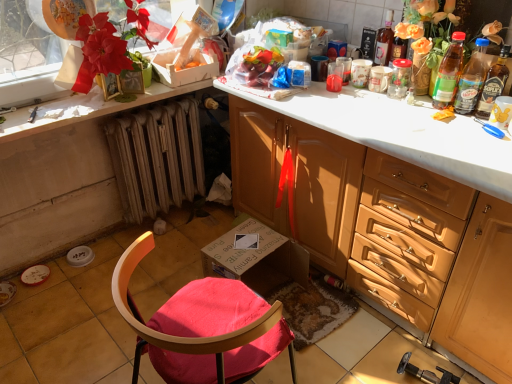
Question: Can you confirm if translucent plastic bottle at upper right, marked as the 3th bottle in a right-to-left arrangement, is smaller than wooden radiator at lower left?

Choices:
 (A) yes
 (B) no

Answer: (A)

Question: From a real-world perspective, is translucent plastic bottle at upper right, marked as the 3th bottle in a right-to-left arrangement, on wooden radiator at lower left?

Choices:
 (A) no
 (B) yes

Answer: (B)

Question: From the image's perspective, does translucent plastic bottle at upper right, marked as the 3th bottle in a right-to-left arrangement, appear higher than wooden radiator at lower left?

Choices:
 (A) no
 (B) yes

Answer: (B)

Question: Is translucent plastic bottle at upper right, marked as the 3th bottle in a right-to-left arrangement, positioned far away from wooden radiator at lower left?

Choices:
 (A) yes
 (B) no

Answer: (A)

Question: From the image's perspective, would you say translucent plastic bottle at upper right, which appears as the second bottle when viewed from the left, is shown under wooden radiator at lower left?

Choices:
 (A) no
 (B) yes

Answer: (A)

Question: Which is correct: wooden radiator at lower left is inside translucent plastic bottle at upper right, the 1th bottle when ordered from right to left, or outside of it?

Choices:
 (A) outside
 (B) inside

Answer: (A)

Question: In the image, is wooden radiator at lower left on the left side or the right side of translucent plastic bottle at upper right, acting as the 4th bottle starting from the left?

Choices:
 (A) left
 (B) right

Answer: (A)

Question: Is wooden radiator at lower left bigger or smaller than translucent plastic bottle at upper right, acting as the 4th bottle starting from the left?

Choices:
 (A) small
 (B) big

Answer: (B)

Question: Considering their positions, is wooden radiator at lower left located in front of or behind translucent plastic bottle at upper right, the 1th bottle when ordered from right to left?

Choices:
 (A) behind
 (B) front

Answer: (A)

Question: Is white glossy countertop at upper left inside or outside of translucent plastic bottle at upper right, which is counted as the 2th bottle, starting from the right?

Choices:
 (A) inside
 (B) outside

Answer: (B)

Question: Looking at their shapes, would you say white glossy countertop at upper left is wider or thinner than translucent plastic bottle at upper right, which is counted as the 2th bottle, starting from the right?

Choices:
 (A) thin
 (B) wide

Answer: (B)

Question: Is white glossy countertop at upper left bigger or smaller than translucent plastic bottle at upper right, which is the third bottle from left to right?

Choices:
 (A) small
 (B) big

Answer: (B)

Question: Considering the positions of white glossy countertop at upper left and translucent plastic bottle at upper right, which is the third bottle from left to right, in the image, is white glossy countertop at upper left taller or shorter than translucent plastic bottle at upper right, which is the third bottle from left to right,?

Choices:
 (A) short
 (B) tall

Answer: (A)

Question: Is point (223, 364) positioned closer to the camera than point (303, 205)?

Choices:
 (A) farther
 (B) closer

Answer: (B)

Question: From the image's perspective, is wooden chair at lower center located above or below matte wood cabinet at center?

Choices:
 (A) above
 (B) below

Answer: (B)